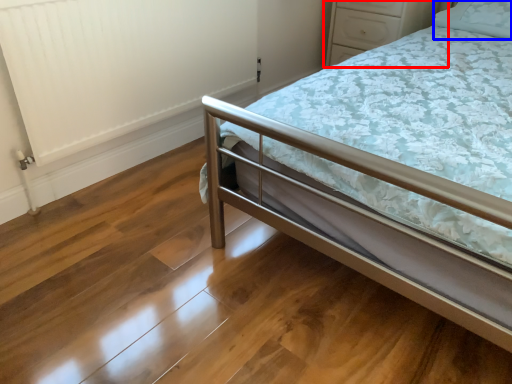
Question: Which object is further to the camera taking this photo, dresser (highlighted by a red box) or pillow (highlighted by a blue box)?

Choices:
 (A) dresser
 (B) pillow

Answer: (A)